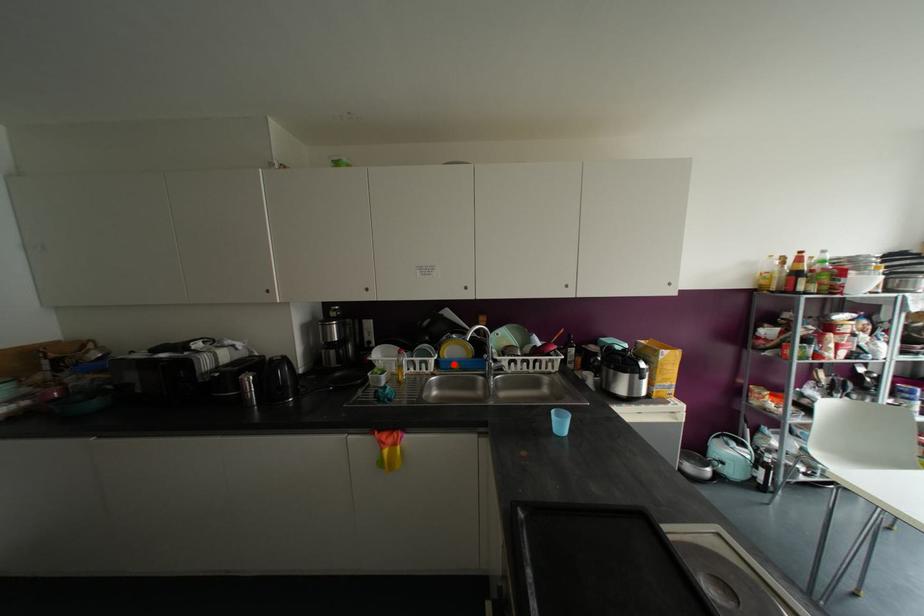
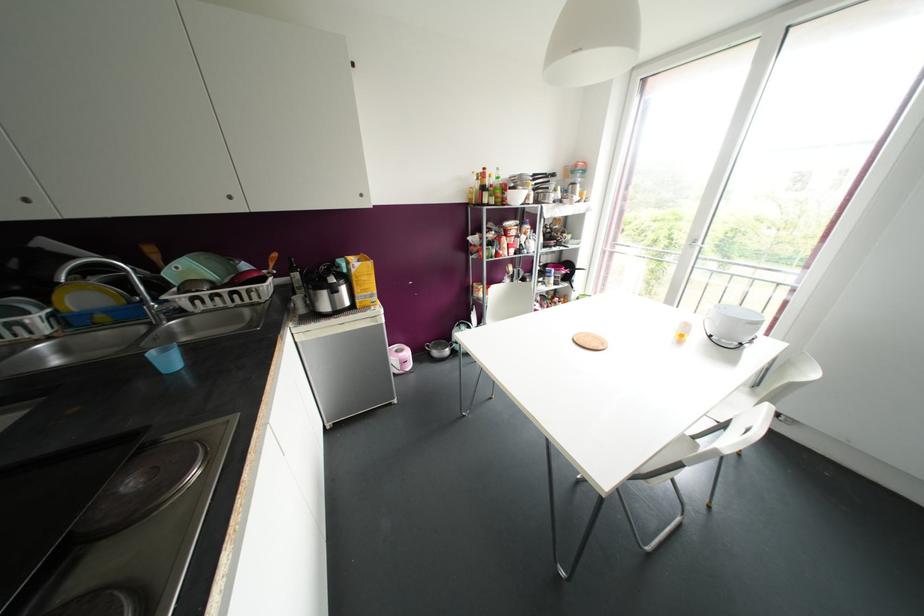
Find the pixel in the second image that matches the highlighted location in the first image.

(101, 317)